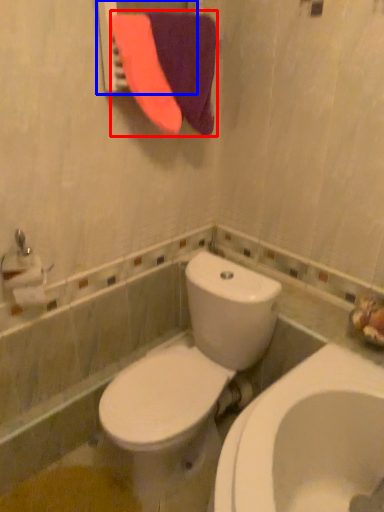
Question: Which point is closer to the camera, beach towel (highlighted by a red box) or mirror (highlighted by a blue box)?

Choices:
 (A) beach towel
 (B) mirror

Answer: (B)